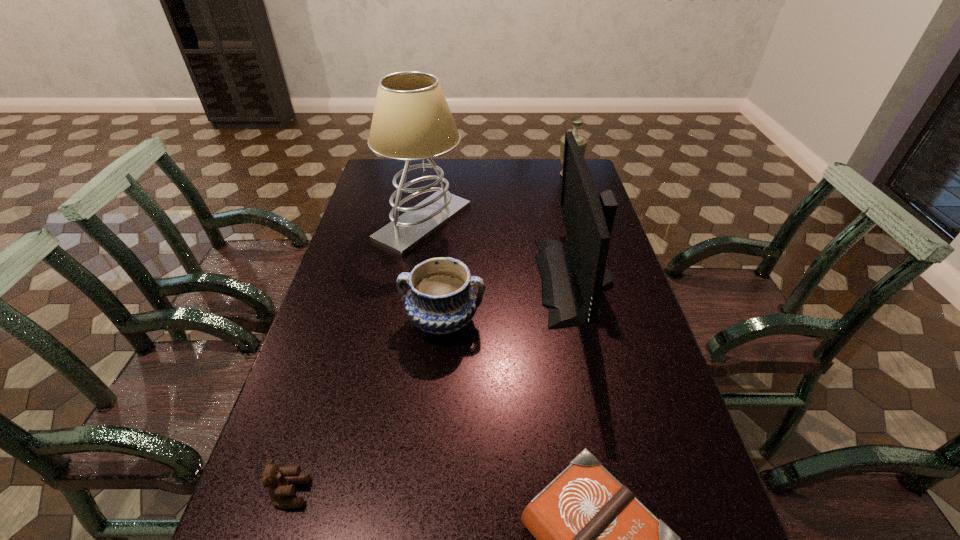
Locate an element on the screen. The width and height of the screenshot is (960, 540). the tallest object is located at coordinates (411, 121).

This screenshot has height=540, width=960. In order to click on the fifth shortest object in this screenshot , I will do `click(573, 279)`.

Identify the location of the farthest object. This screenshot has height=540, width=960. (582, 141).

In order to click on the fourth shortest object in this screenshot , I will do `click(582, 141)`.

Identify the location of the fourth tallest object. The height and width of the screenshot is (540, 960). (441, 299).

At what (x,y) coordinates should I click in order to perform the action: click on teddy bear. Please return your answer as a coordinate pair (x, y). Looking at the image, I should click on (280, 483).

This screenshot has width=960, height=540. What are the coordinates of `vacant area located on the right of the tallest object` in the screenshot? It's located at click(540, 222).

Where is `vacant region located 0.100m on the screen side of the fifth shortest object`? The height and width of the screenshot is (540, 960). vacant region located 0.100m on the screen side of the fifth shortest object is located at coordinates (505, 280).

Locate an element on the screen. The height and width of the screenshot is (540, 960). free space located on the screen side of the fifth shortest object is located at coordinates [466, 280].

This screenshot has height=540, width=960. I want to click on vacant point located on the screen side of the fifth shortest object, so click(x=502, y=280).